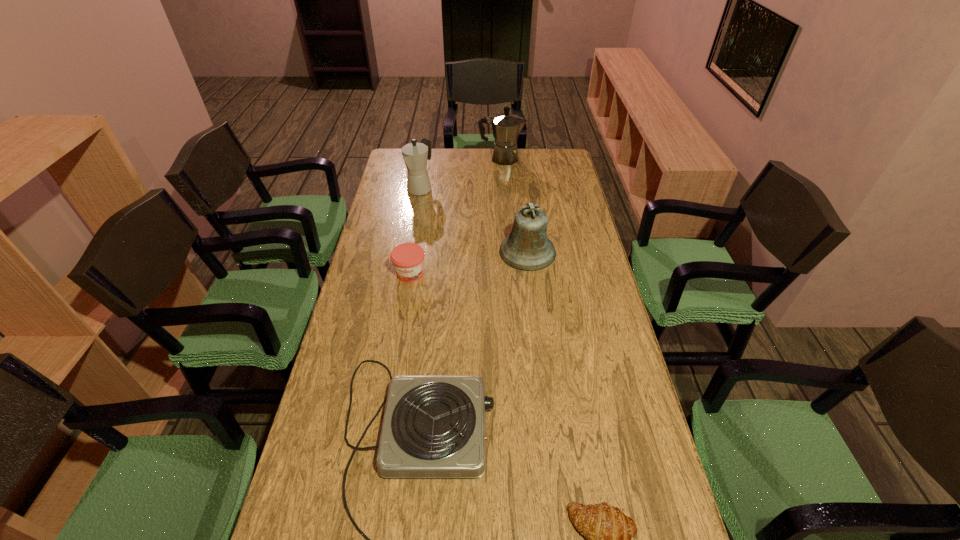
Identify which object is located as the fourth nearest to the fifth nearest object. Please provide its 2D coordinates. Your answer should be formatted as a tuple, i.e. [(x, y)], where the tuple contains the x and y coordinates of a point satisfying the conditions above.

[(434, 426)]

At what (x,y) coordinates should I click in order to perform the action: click on the fourth closest object to the crescent roll. Please return your answer as a coordinate pair (x, y). Image resolution: width=960 pixels, height=540 pixels. Looking at the image, I should click on (415, 155).

Locate an element on the screen. vacant space that satisfies the following two spatial constraints: 1. on the pouring side of the farthest object; 2. on the back side of the bell is located at coordinates (508, 252).

At what (x,y) coordinates should I click in order to perform the action: click on vacant area in the image that satisfies the following two spatial constraints: 1. on the pouring side of the bell; 2. on the right side of the right coffeepot. Please return your answer as a coordinate pair (x, y). The height and width of the screenshot is (540, 960). Looking at the image, I should click on (508, 252).

The image size is (960, 540). Identify the location of vacant area in the image that satisfies the following two spatial constraints: 1. on the pouring side of the farthest object; 2. on the front side of the fifth nearest object. (504, 188).

Locate an element on the screen. blank area in the image that satisfies the following two spatial constraints: 1. on the back side of the bell; 2. on the pouring side of the right coffeepot is located at coordinates (516, 158).